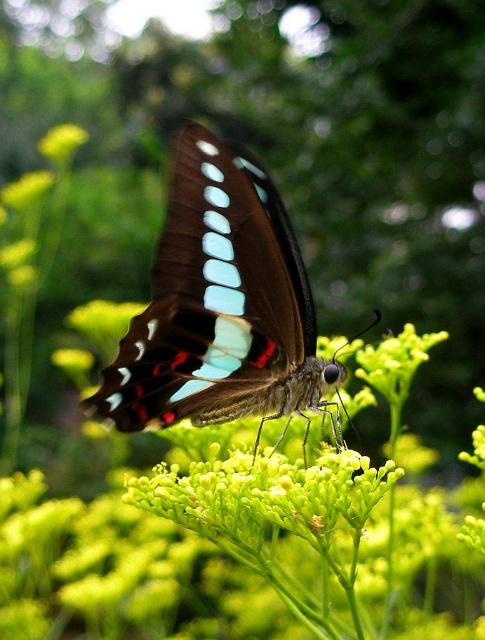
Question: In this image, where is shiny brown butterfly at center located relative to green matte flower at upper left?

Choices:
 (A) below
 (B) above

Answer: (A)

Question: Which of the following is the farthest from the observer?

Choices:
 (A) shiny brown butterfly at center
 (B) green matte flower at upper left

Answer: (B)

Question: Can you confirm if shiny brown butterfly at center is smaller than green matte flower at upper left?

Choices:
 (A) yes
 (B) no

Answer: (B)

Question: Is shiny brown butterfly at center smaller than green matte flower at upper left?

Choices:
 (A) yes
 (B) no

Answer: (B)